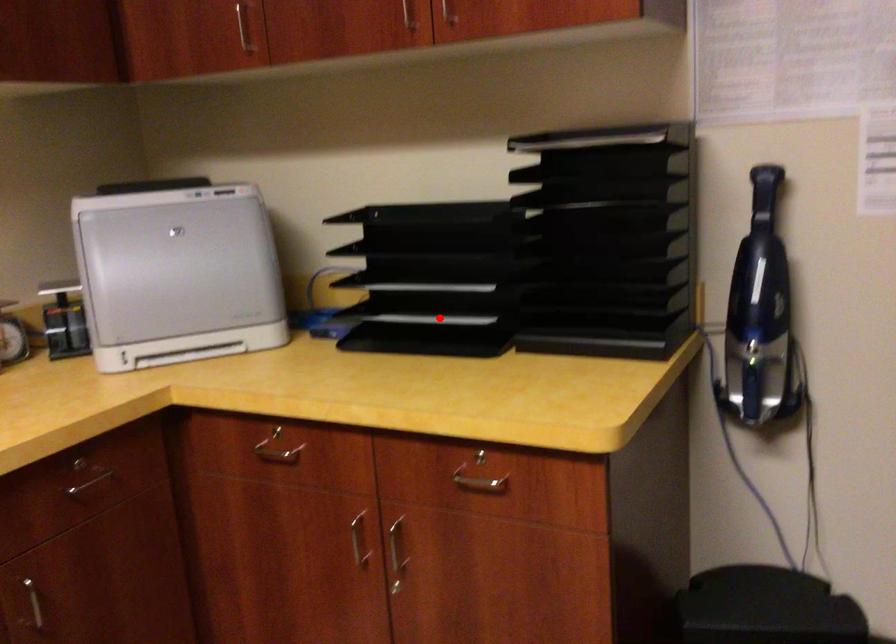
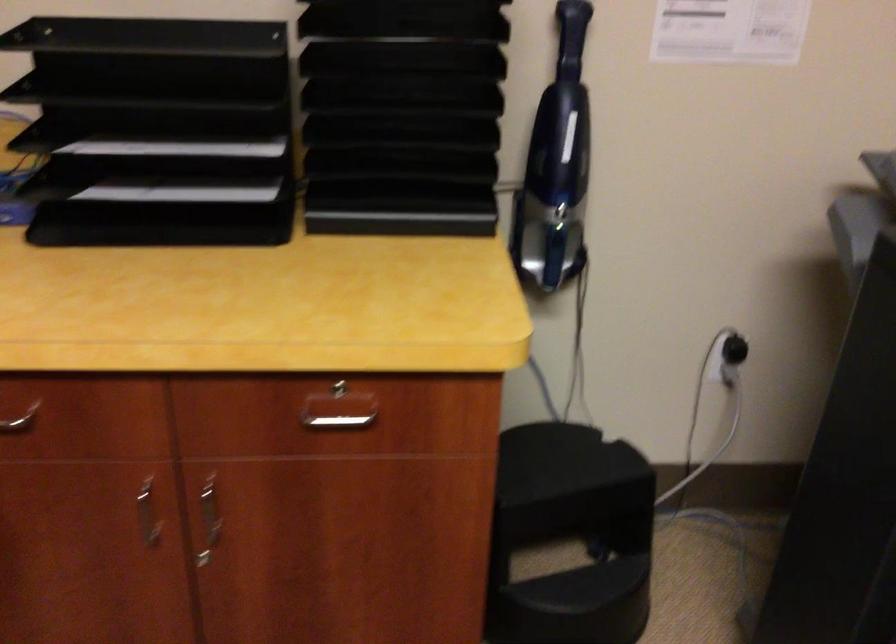
Where in the second image is the point corresponding to the highlighted location from the first image?

(183, 191)